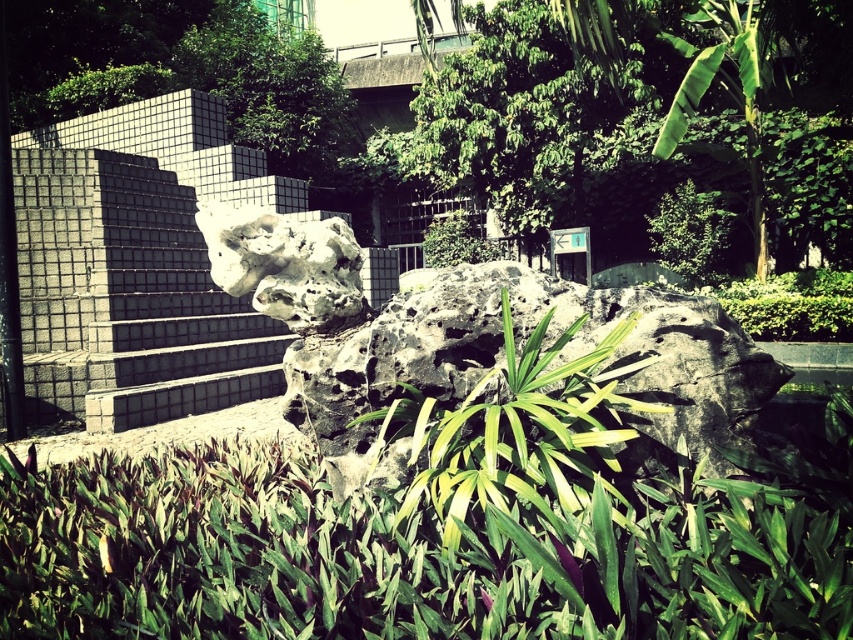
Question: Which point is farther to the camera?

Choices:
 (A) (659, 256)
 (B) (581, 86)
 (C) (142, 97)

Answer: (A)

Question: Can you confirm if white matte rock at center is positioned below green leafy bush at upper right?

Choices:
 (A) yes
 (B) no

Answer: (A)

Question: Among these points, which one is farthest from the camera?

Choices:
 (A) (352, 298)
 (B) (735, 140)
 (C) (660, 196)

Answer: (B)

Question: Which of these objects is positioned farthest from the green leafy bush at upper right?

Choices:
 (A) white matte rock at center
 (B) green leafy bush at upper left
 (C) green leafy tree at upper center
 (D) white stone sculpture at center

Answer: (A)

Question: Can you confirm if green leafy tree at upper center is thinner than white matte rock at center?

Choices:
 (A) no
 (B) yes

Answer: (A)

Question: Is green leafy tree at upper center to the right of green leafy bush at upper left from the viewer's perspective?

Choices:
 (A) yes
 (B) no

Answer: (A)